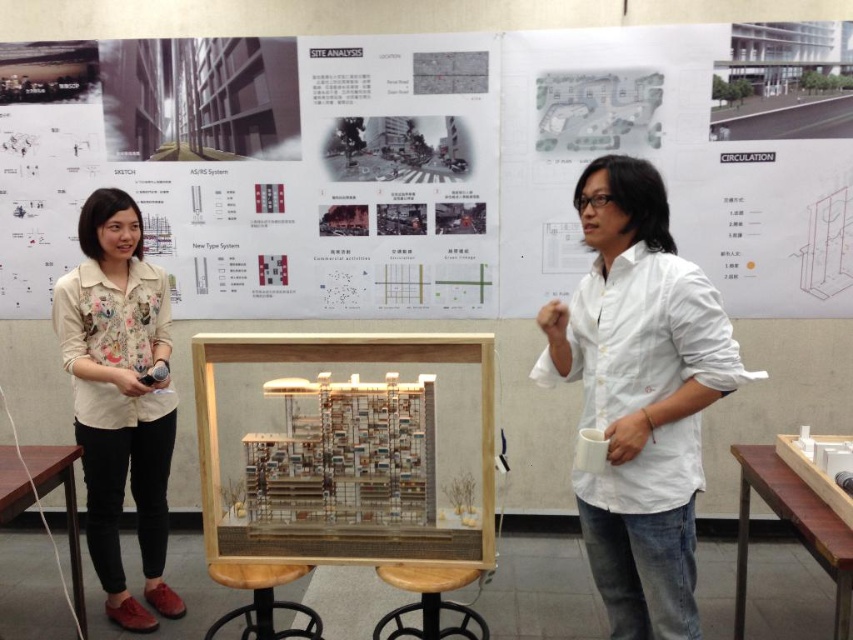
Is white paper at upper center smaller than brown wooden stool at lower center?

No, white paper at upper center is not smaller than brown wooden stool at lower center.

Who is higher up, white paper at upper center or brown wooden stool at lower center?

white paper at upper center is higher up.

Where is `white paper at upper center`? This screenshot has width=853, height=640. white paper at upper center is located at coordinates (438, 180).

The image size is (853, 640). What are the coordinates of `wooden frame at center` in the screenshot? It's located at coord(349,525).

Looking at this image, does wooden frame at center have a greater width compared to brown wooden stool at lower center?

Yes, wooden frame at center is wider than brown wooden stool at lower center.

Where is `wooden frame at center`? This screenshot has height=640, width=853. wooden frame at center is located at coordinates (349, 525).

Between wooden frame at center and wooden stool at center, which one is positioned lower?

wooden stool at center

Locate an element on the screen. Image resolution: width=853 pixels, height=640 pixels. wooden frame at center is located at coordinates (349, 525).